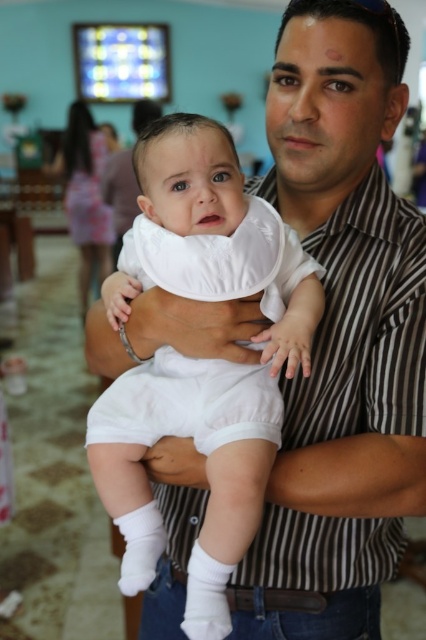
You are a photographer trying to capture a closeup shot of the baby. You are currently holding a camera that has a minimum focusing distance of 30 inches. Based on the scene, will you be able to take a clear photo of the white soft bib at center?

The white soft bib at center is 29.69 inches from the viewer, which is within the camera minimum focusing distance of 30 inches. Therefore, you can take a clear photo of the white soft bib at center.

You are a photographer trying to capture the baby in focus. The baby is wearing a white soft bib at center and the man is wearing a white striped shirt at center. Which white item is closer to the camera lens?

The white soft bib at center is located above the white striped shirt at center, so it is closer to the camera lens.